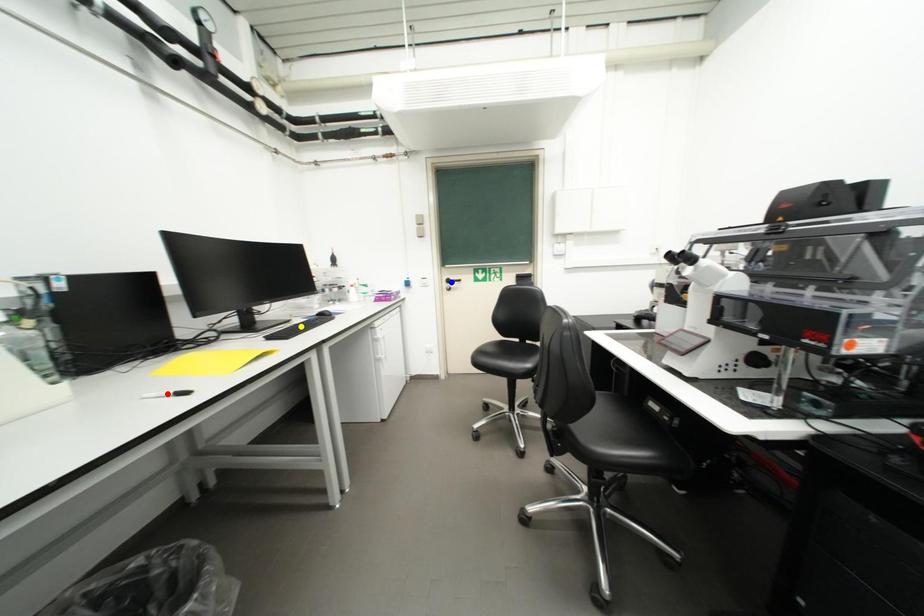
Order these from farthest to nearest:
red point
yellow point
blue point

blue point → yellow point → red point